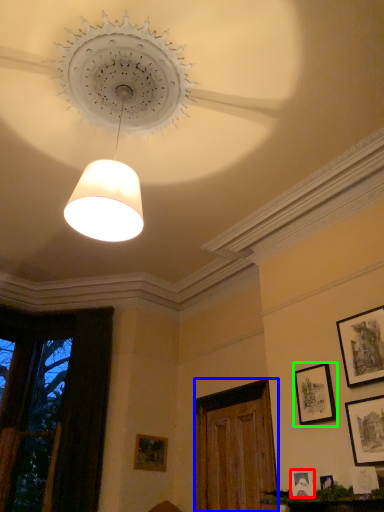
Question: Which is farther away from picture frame (highlighted by a red box)? glass door (highlighted by a blue box) or picture frame (highlighted by a green box)?

Choices:
 (A) glass door
 (B) picture frame

Answer: (A)